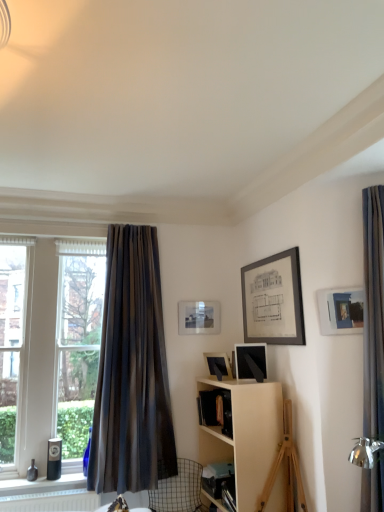
Question: From a real-world perspective, is dark gray textured curtain at left beneath matte white picture frame at upper right, which ranks as the 1th picture frame in right-to-left order?

Choices:
 (A) no
 (B) yes

Answer: (B)

Question: From the image's perspective, is dark gray textured curtain at left below matte white picture frame at upper right, which appears as the fourth picture frame when viewed from the back?

Choices:
 (A) yes
 (B) no

Answer: (A)

Question: Considering the relative sizes of dark gray textured curtain at left and matte white picture frame at upper right, the first picture frame when ordered from front to back, in the image provided, is dark gray textured curtain at left shorter than matte white picture frame at upper right, the first picture frame when ordered from front to back,?

Choices:
 (A) yes
 (B) no

Answer: (B)

Question: Is dark gray textured curtain at left not close to matte white picture frame at upper right, which is the fourth picture frame from left to right?

Choices:
 (A) yes
 (B) no

Answer: (A)

Question: Is dark gray textured curtain at left oriented towards matte white picture frame at upper right, which appears as the fourth picture frame when viewed from the back?

Choices:
 (A) yes
 (B) no

Answer: (B)

Question: Considering the relative positions of dark gray textured curtain at left and matte black picture frame at upper right, the 2th picture frame viewed from the front, in the image provided, is dark gray textured curtain at left to the left or to the right of matte black picture frame at upper right, the 2th picture frame viewed from the front,?

Choices:
 (A) left
 (B) right

Answer: (A)

Question: Is dark gray textured curtain at left bigger or smaller than matte black picture frame at upper right, the 3th picture frame in the left-to-right sequence?

Choices:
 (A) big
 (B) small

Answer: (A)

Question: Is dark gray textured curtain at left inside the boundaries of matte black picture frame at upper right, the 2th picture frame viewed from the front, or outside?

Choices:
 (A) outside
 (B) inside

Answer: (A)

Question: From a real-world perspective, is dark gray textured curtain at left positioned above or below matte black picture frame at upper right, the second picture frame positioned from the right?

Choices:
 (A) above
 (B) below

Answer: (A)

Question: Relative to matte black picture frame at center, which is counted as the third picture frame, starting from the front, is dark gray textured curtain at left in front or behind?

Choices:
 (A) behind
 (B) front

Answer: (B)

Question: From a real-world perspective, is dark gray textured curtain at left positioned above or below matte black picture frame at center, which is counted as the third picture frame, starting from the front?

Choices:
 (A) above
 (B) below

Answer: (A)

Question: Is point (112, 271) closer or farther from the camera than point (210, 373)?

Choices:
 (A) farther
 (B) closer

Answer: (B)

Question: From the image's perspective, is dark gray textured curtain at left located above or below matte black picture frame at center, the 2th picture frame in the back-to-front sequence?

Choices:
 (A) above
 (B) below

Answer: (A)

Question: Looking at the image, does matte black picture frame at upper right, the second picture frame positioned from the right, seem bigger or smaller compared to metallic wire swivel chair at lower left?

Choices:
 (A) big
 (B) small

Answer: (B)

Question: From a real-world perspective, is matte black picture frame at upper right, the 2th picture frame viewed from the front, positioned above or below metallic wire swivel chair at lower left?

Choices:
 (A) below
 (B) above

Answer: (B)